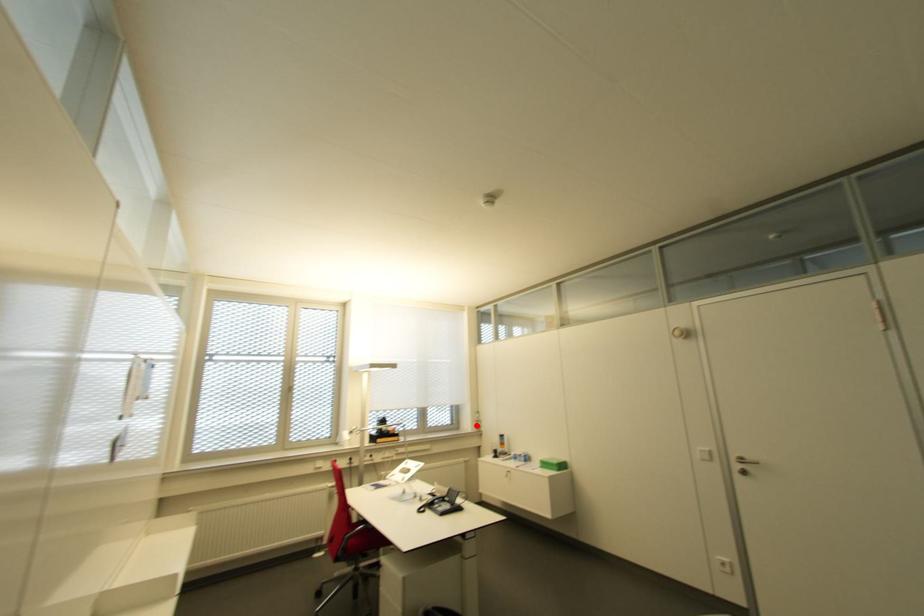
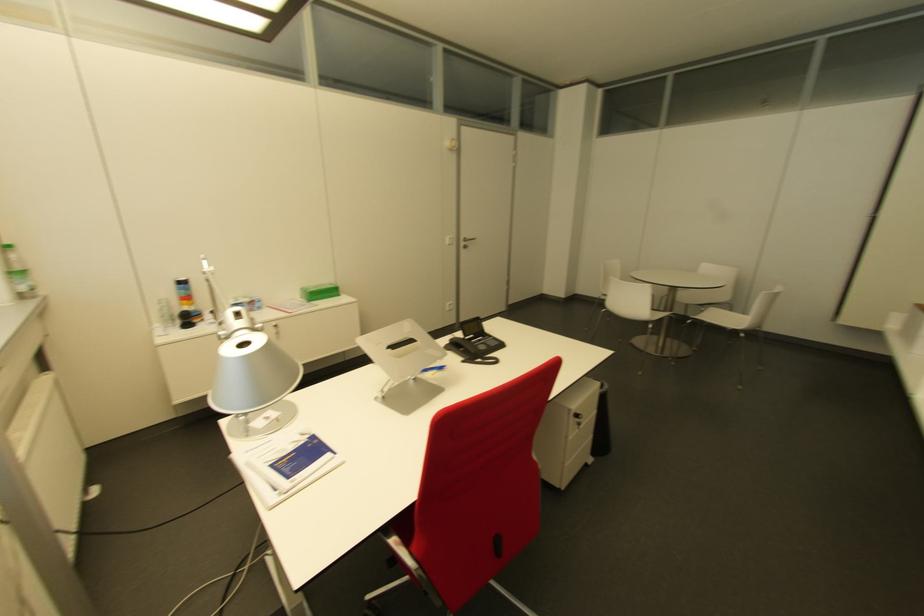
Locate, in the second image, the point that corresponds to the highlighted location in the first image.

(27, 284)